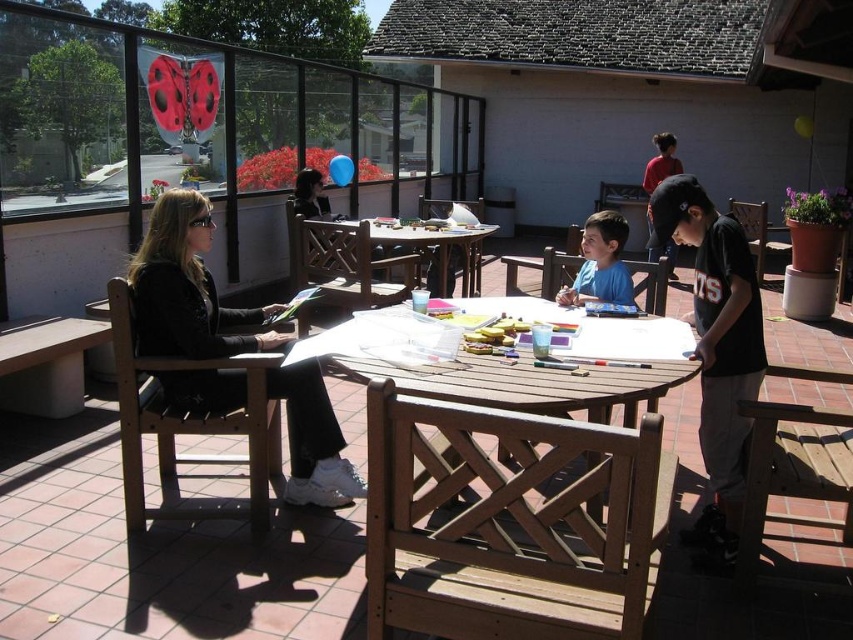
Question: Which of the following is the farthest from the observer?

Choices:
 (A) blue matte shirt at center
 (B) wooden picnic table at center

Answer: (A)

Question: From the image, what is the correct spatial relationship of black leather jacket at left in relation to blue matte shirt at center?

Choices:
 (A) below
 (B) above

Answer: (A)

Question: Considering the real-world distances, which object is closest to the wooden picnic table at center?

Choices:
 (A) blue matte shirt at center
 (B) black leather jacket at left
 (C) black cotton shirt at center
 (D) wooden table at center

Answer: (C)

Question: Considering the relative positions of blue matte shirt at center and wooden table at center in the image provided, where is blue matte shirt at center located with respect to wooden table at center?

Choices:
 (A) above
 (B) below

Answer: (B)

Question: Which point is closer to the camera?

Choices:
 (A) (619, 262)
 (B) (547, 472)
 (C) (222, 410)

Answer: (B)

Question: Can you confirm if black leather jacket at left is thinner than black cotton shirt at center?

Choices:
 (A) yes
 (B) no

Answer: (B)